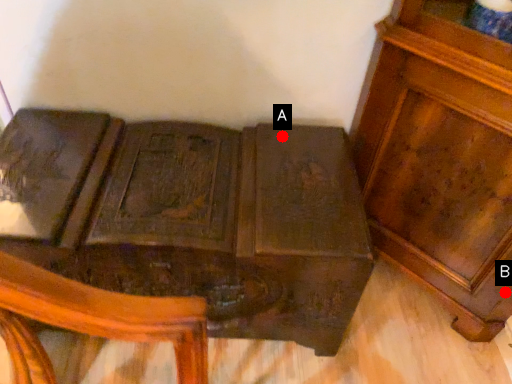
Question: Two points are circled on the image, labeled by A and B beside each circle. Which point is closer to the camera taking this photo?

Choices:
 (A) A is closer
 (B) B is closer

Answer: (B)